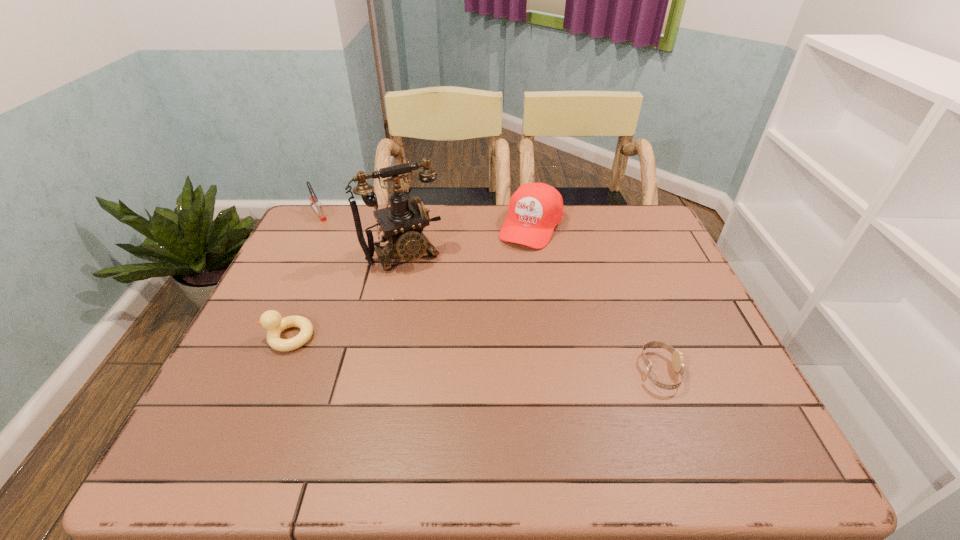
Image resolution: width=960 pixels, height=540 pixels. I want to click on vacant area that lies between the watch and the stapler, so click(490, 292).

This screenshot has width=960, height=540. What are the coordinates of `free space that is in between the shortest object and the second tallest object` in the screenshot? It's located at (595, 299).

Select which object is the third closest to the second tallest object. Please provide its 2D coordinates. Your answer should be formatted as a tuple, i.e. [(x, y)], where the tuple contains the x and y coordinates of a point satisfying the conditions above.

[(271, 320)]

Image resolution: width=960 pixels, height=540 pixels. What are the coordinates of `object that can be found as the fourth closest to the second shortest object` in the screenshot? It's located at (677, 356).

The image size is (960, 540). Find the location of `free location that satisfies the following two spatial constraints: 1. on the front side of the third tallest object; 2. on the face of the watch`. free location that satisfies the following two spatial constraints: 1. on the front side of the third tallest object; 2. on the face of the watch is located at coordinates (239, 371).

Find the location of a particular element. vacant space that satisfies the following two spatial constraints: 1. on the front side of the shortest object; 2. on the face of the tallest object is located at coordinates (379, 371).

I want to click on free space that satisfies the following two spatial constraints: 1. on the front side of the stapler; 2. on the face of the shortest object, so click(x=239, y=371).

Where is `free space that satisfies the following two spatial constraints: 1. on the front side of the third object from right to left; 2. on the left side of the third tallest object`? The image size is (960, 540). free space that satisfies the following two spatial constraints: 1. on the front side of the third object from right to left; 2. on the left side of the third tallest object is located at coordinates (299, 253).